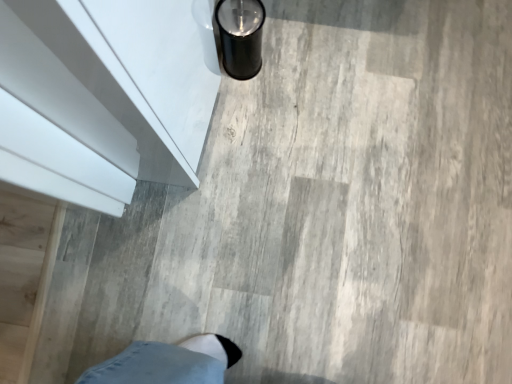
Locate an element on the screen. The width and height of the screenshot is (512, 384). free spot in front of black matte shoe at lower center is located at coordinates (252, 112).